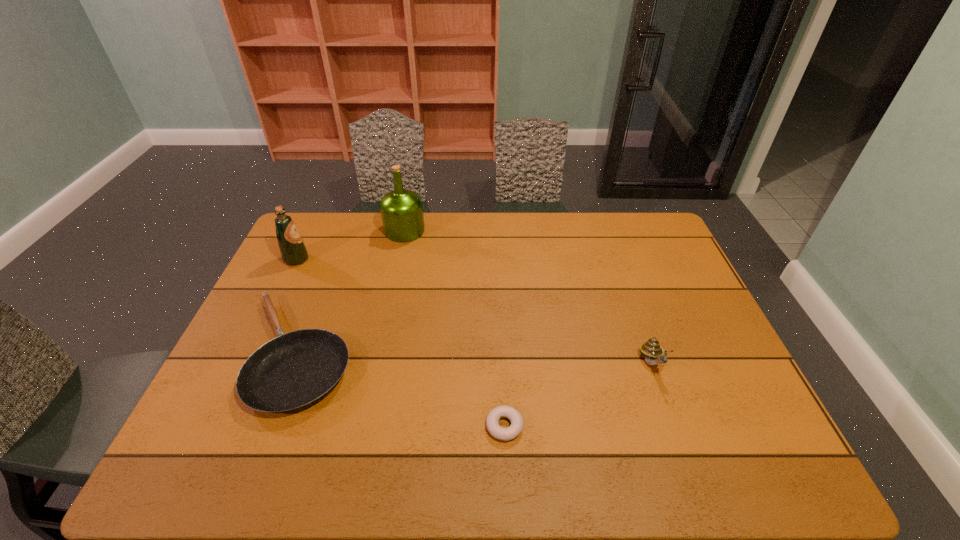
What are the coordinates of `unoccupied area between the frying pan and the nearer olive oil` in the screenshot? It's located at (297, 306).

Find the location of a particular element. This screenshot has width=960, height=540. blank region between the second farthest object and the rightmost object is located at coordinates (474, 311).

You are a GUI agent. You are given a task and a screenshot of the screen. Output one action in this format:
    pyautogui.click(x=<x>, y=<y>)
    Task: Click on the free space between the rightmost object and the left olive oil
    The height and width of the screenshot is (540, 960).
    Given the screenshot: What is the action you would take?
    pyautogui.click(x=474, y=311)

Find the location of a particular element. object that is the third closest to the snail is located at coordinates click(x=401, y=209).

Identify the location of object that can be found as the fourth closest to the rightmost object. This screenshot has height=540, width=960. (293, 250).

The image size is (960, 540). Find the location of `vacant space that satisfies the following two spatial constraints: 1. on the front-facing side of the nearer olive oil; 2. on the left side of the doughnut`. vacant space that satisfies the following two spatial constraints: 1. on the front-facing side of the nearer olive oil; 2. on the left side of the doughnut is located at coordinates pyautogui.click(x=216, y=426).

This screenshot has height=540, width=960. Find the location of `free location that satisfies the following two spatial constraints: 1. on the front side of the second shortest object; 2. on the right side of the doughnut`. free location that satisfies the following two spatial constraints: 1. on the front side of the second shortest object; 2. on the right side of the doughnut is located at coordinates (270, 426).